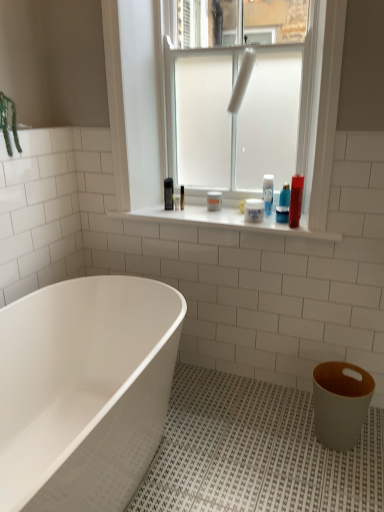
Question: Considering the relative sizes of green matte plant at upper left and clear glass window screen at upper center in the image provided, is green matte plant at upper left smaller than clear glass window screen at upper center?

Choices:
 (A) yes
 (B) no

Answer: (A)

Question: Is green matte plant at upper left completely or partially outside of clear glass window screen at upper center?

Choices:
 (A) yes
 (B) no

Answer: (A)

Question: Is green matte plant at upper left behind clear glass window screen at upper center?

Choices:
 (A) no
 (B) yes

Answer: (A)

Question: Does green matte plant at upper left turn towards clear glass window screen at upper center?

Choices:
 (A) yes
 (B) no

Answer: (B)

Question: Can you confirm if green matte plant at upper left is wider than clear glass window screen at upper center?

Choices:
 (A) yes
 (B) no

Answer: (A)

Question: From a real-world perspective, is green matte plant at upper left positioned under clear glass window screen at upper center based on gravity?

Choices:
 (A) no
 (B) yes

Answer: (B)

Question: Does green matte plant at upper left appear on the left side of shiny plastic tube at upper right, the first toiletry in the right-to-left sequence?

Choices:
 (A) no
 (B) yes

Answer: (B)

Question: Does green matte plant at upper left have a lesser height compared to shiny plastic tube at upper right, the first toiletry in the right-to-left sequence?

Choices:
 (A) no
 (B) yes

Answer: (A)

Question: Would you say green matte plant at upper left contains shiny plastic tube at upper right, the first toiletry in the right-to-left sequence?

Choices:
 (A) yes
 (B) no

Answer: (B)

Question: Does green matte plant at upper left touch shiny plastic tube at upper right, marked as the 2th toiletry in a left-to-right arrangement?

Choices:
 (A) no
 (B) yes

Answer: (A)

Question: Can you confirm if green matte plant at upper left is thinner than shiny plastic tube at upper right, the first toiletry in the right-to-left sequence?

Choices:
 (A) no
 (B) yes

Answer: (A)

Question: From a real-world perspective, is green matte plant at upper left positioned over shiny plastic tube at upper right, marked as the 2th toiletry in a left-to-right arrangement, based on gravity?

Choices:
 (A) no
 (B) yes

Answer: (B)

Question: Is shiny plastic tube at upper right, the first toiletry in the right-to-left sequence, in contact with white matte jar at center, the first toiletry from the left?

Choices:
 (A) yes
 (B) no

Answer: (B)